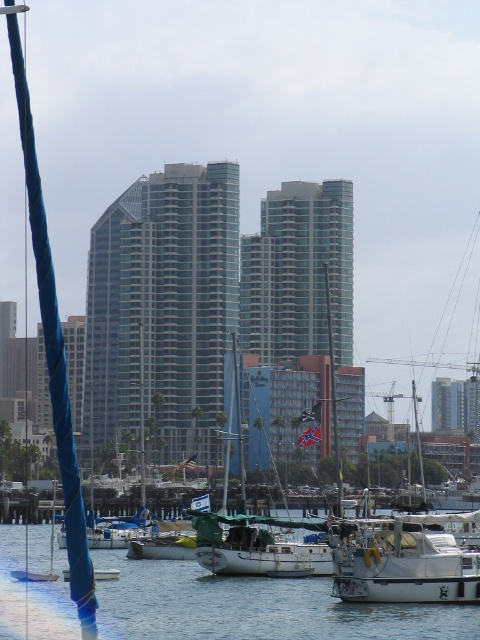
Question: Which point appears closest to the camera in this image?

Choices:
 (A) (245, 592)
 (B) (203, 538)

Answer: (A)

Question: Can you confirm if white matte boat at center is positioned below white matte sailboat at center?

Choices:
 (A) no
 (B) yes

Answer: (A)

Question: Can you confirm if clear water at lower center is smaller than white matte sailboat at center?

Choices:
 (A) yes
 (B) no

Answer: (B)

Question: Considering the real-world distances, which object is closest to the white matte boat at center?

Choices:
 (A) white matte sailboat at center
 (B) clear water at lower center

Answer: (B)

Question: Does white matte boat at center have a larger size compared to white matte sailboat at center?

Choices:
 (A) yes
 (B) no

Answer: (B)

Question: Which of the following is the farthest from the observer?

Choices:
 (A) white matte boat at center
 (B) clear water at lower center

Answer: (A)